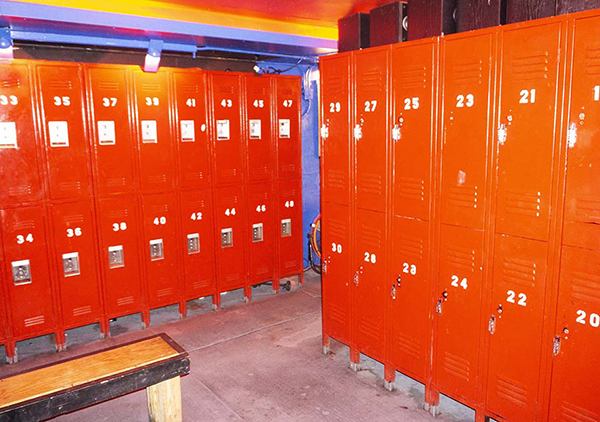
This screenshot has height=422, width=600. Identify the location of grout lines on concrete floor. click(210, 390), click(233, 336), click(308, 292).